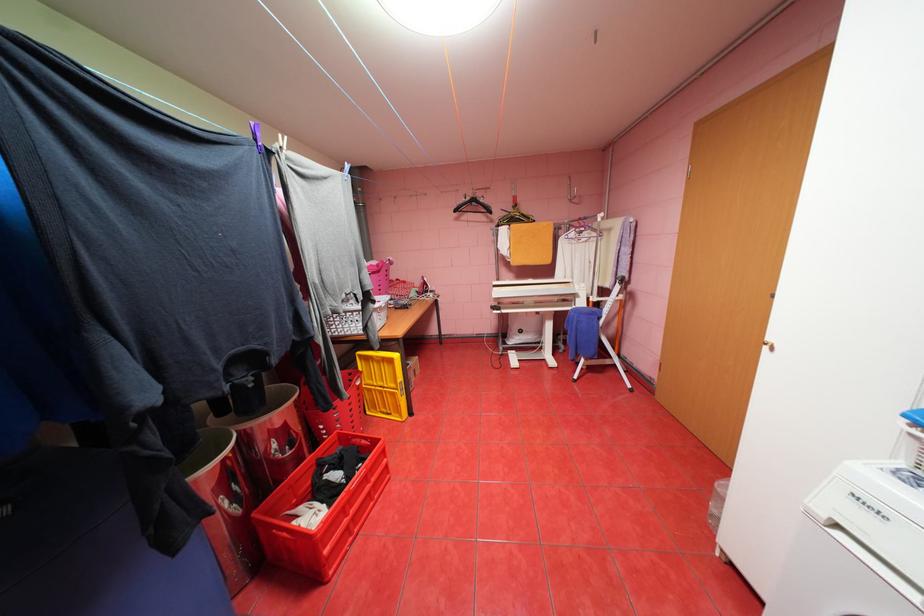
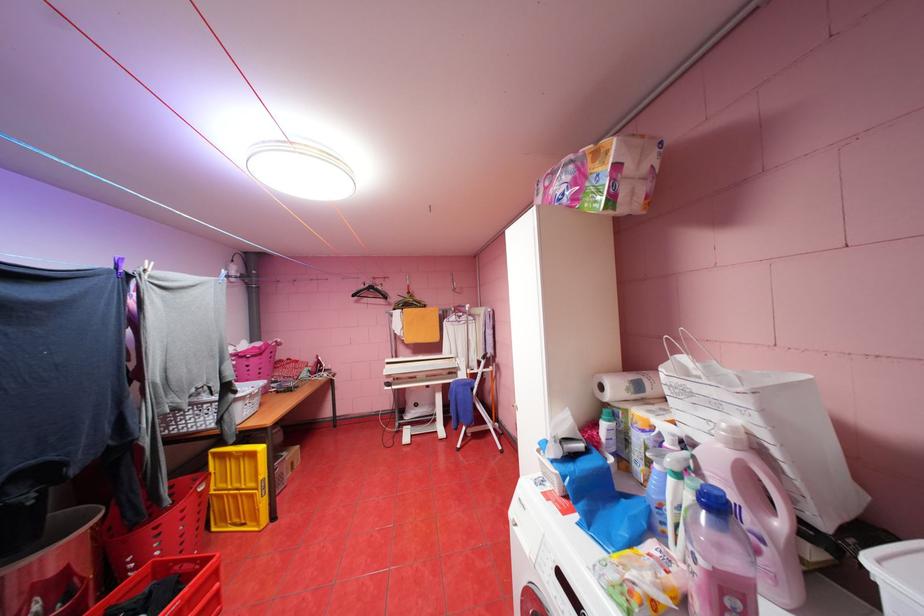
Locate, in the second image, the point that corresponds to [355,395] in the first image.

(176, 501)